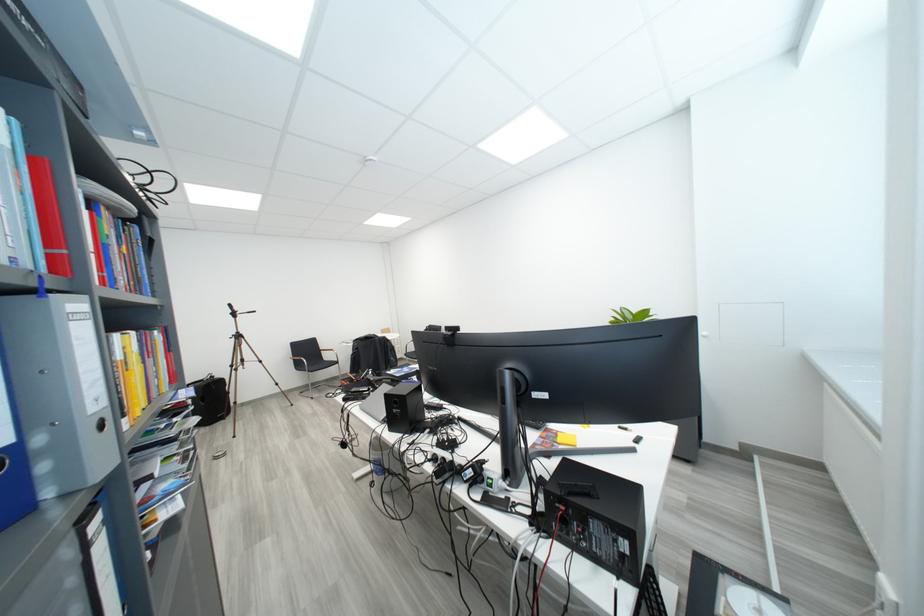
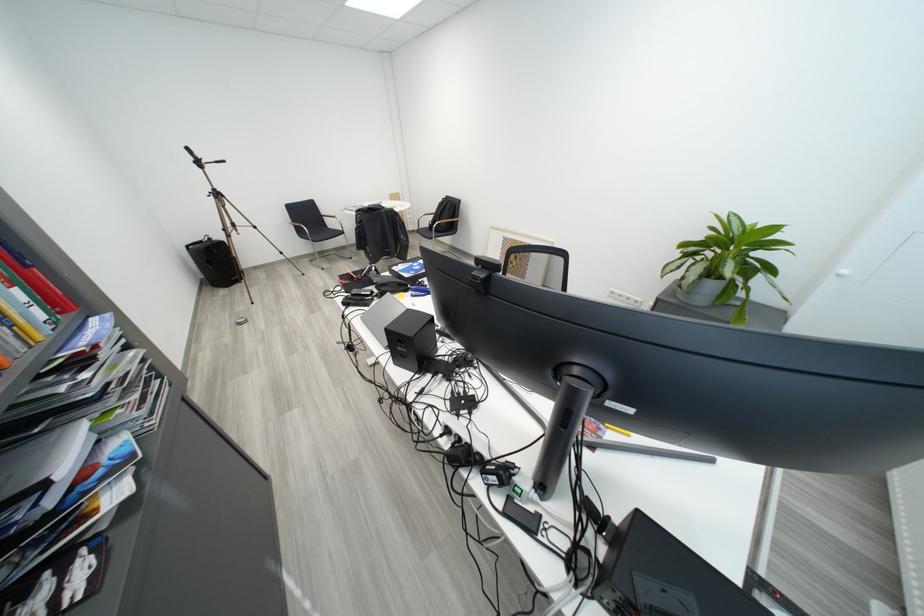
Question: The first image is from the beginning of the video and the second image is from the end. How did the camera likely rotate when shooting the video?

Choices:
 (A) Left
 (B) Right
 (C) Up
 (D) Down

Answer: (D)